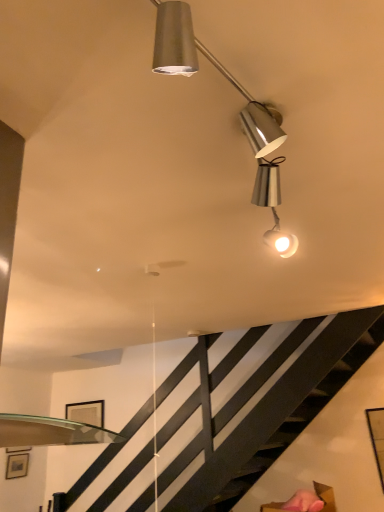
Question: Looking at the image, does matte black picture frame at upper center, the first picture frame viewed from the top, seem bigger or smaller compared to matte black picture frame at lower left, the first picture frame in the bottom-to-top sequence?

Choices:
 (A) small
 (B) big

Answer: (B)

Question: Does point (97, 403) appear closer or farther from the camera than point (16, 477)?

Choices:
 (A) farther
 (B) closer

Answer: (B)

Question: Considering the real-world distances, which object is farthest from the matte black picture frame at upper center, which is counted as the 2th picture frame, starting from the bottom?

Choices:
 (A) metallic silver lamp at upper center
 (B) matte black picture frame at lower left, acting as the second picture frame starting from the right

Answer: (A)

Question: Estimate the real-world distances between objects in this image. Which object is farther from the matte black picture frame at lower left, which is the first picture frame in left-to-right order?

Choices:
 (A) matte black picture frame at upper center, which is counted as the 2th picture frame, starting from the bottom
 (B) metallic silver lamp at upper center

Answer: (B)